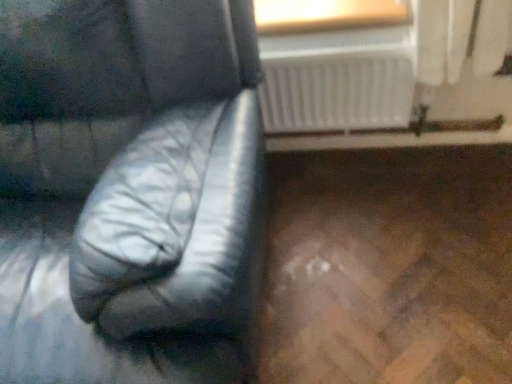
Question: Is black leather armchair at left positioned far away from white plastic radiator at upper center?

Choices:
 (A) no
 (B) yes

Answer: (A)

Question: Is black leather armchair at left positioned before white plastic radiator at upper center?

Choices:
 (A) no
 (B) yes

Answer: (B)

Question: From a real-world perspective, is black leather armchair at left on top of white plastic radiator at upper center?

Choices:
 (A) yes
 (B) no

Answer: (A)

Question: Is black leather armchair at left thinner than white plastic radiator at upper center?

Choices:
 (A) no
 (B) yes

Answer: (A)

Question: From a real-world perspective, is black leather armchair at left under white plastic radiator at upper center?

Choices:
 (A) yes
 (B) no

Answer: (B)

Question: Can you confirm if black leather armchair at left is positioned to the right of white plastic radiator at upper center?

Choices:
 (A) no
 (B) yes

Answer: (A)

Question: Is white plastic radiator at upper center smaller than wooden frame at upper center?

Choices:
 (A) yes
 (B) no

Answer: (B)

Question: Can you see white plastic radiator at upper center touching wooden frame at upper center?

Choices:
 (A) no
 (B) yes

Answer: (A)

Question: Considering the relative sizes of white plastic radiator at upper center and wooden frame at upper center in the image provided, is white plastic radiator at upper center thinner than wooden frame at upper center?

Choices:
 (A) no
 (B) yes

Answer: (B)

Question: Considering the relative sizes of white plastic radiator at upper center and wooden frame at upper center in the image provided, is white plastic radiator at upper center bigger than wooden frame at upper center?

Choices:
 (A) yes
 (B) no

Answer: (A)

Question: Can we say white plastic radiator at upper center lies outside wooden frame at upper center?

Choices:
 (A) yes
 (B) no

Answer: (A)

Question: Is white plastic radiator at upper center to the left of wooden frame at upper center from the viewer's perspective?

Choices:
 (A) no
 (B) yes

Answer: (A)

Question: Is wooden frame at upper center in front of white plastic radiator at upper center?

Choices:
 (A) yes
 (B) no

Answer: (B)